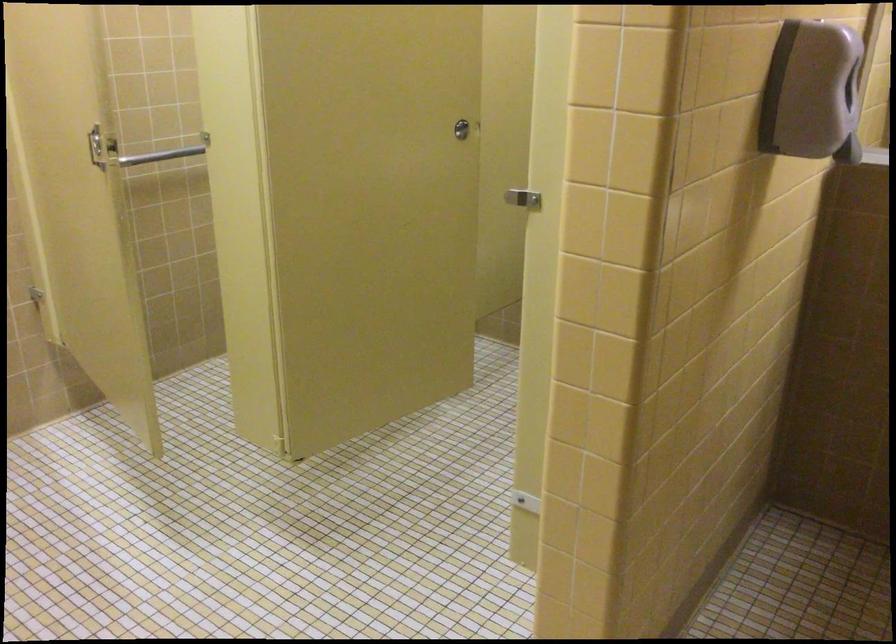
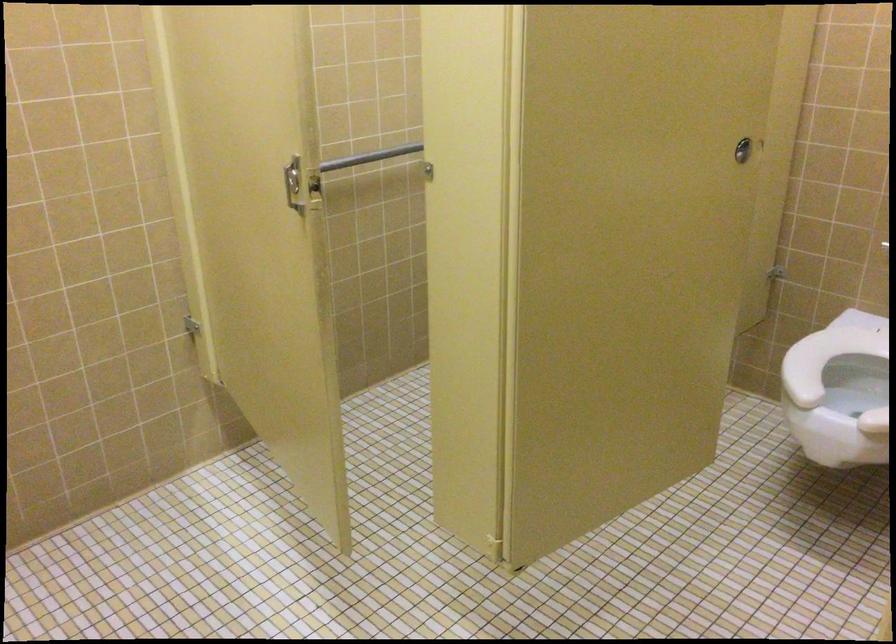
What movement of the cameraman would produce the second image?

The movement direction of the cameraman is left, forward.